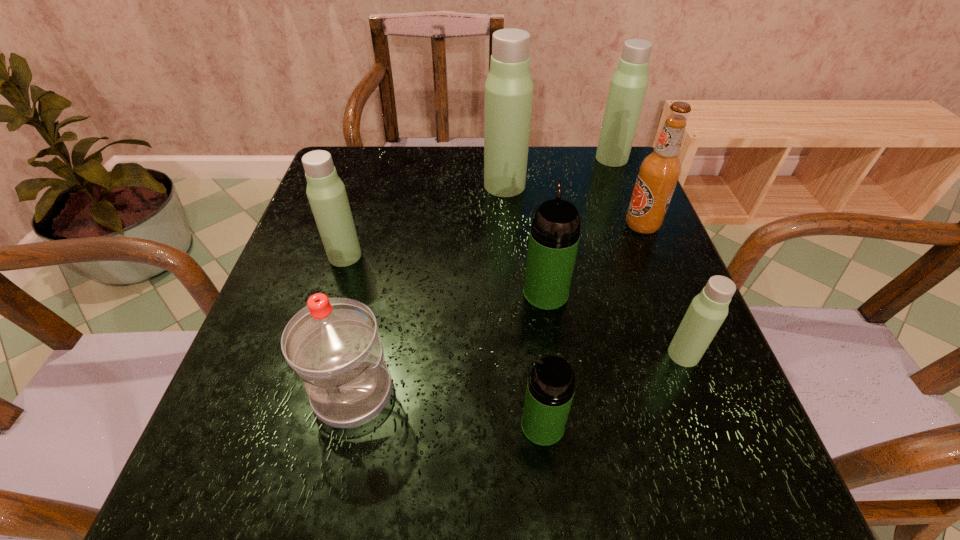
You are a GUI agent. You are given a task and a screenshot of the screen. Output one action in this format:
    pyautogui.click(x=<x>, y=<y>)
    Task: Click on the empty location between the fourth nearest object and the third farthest object
    The width and height of the screenshot is (960, 540).
    Given the screenshot: What is the action you would take?
    pyautogui.click(x=594, y=259)

This screenshot has width=960, height=540. Identify the location of free point between the second light thermos bottle from left to right and the second nearest thermos bottle. (594, 270).

Identify the location of free area in between the leftmost thermos bottle and the tallest thermos bottle. This screenshot has height=540, width=960. (424, 220).

Locate an element on the screen. The width and height of the screenshot is (960, 540). free space between the third farthest light thermos bottle and the tallest object is located at coordinates (424, 220).

You are a GUI agent. You are given a task and a screenshot of the screen. Output one action in this format:
    pyautogui.click(x=<x>, y=<y>)
    Task: Click on the empty space that is in between the smaller green thermos bottle and the smallest light thermos bottle
    This screenshot has width=960, height=540.
    Given the screenshot: What is the action you would take?
    pyautogui.click(x=613, y=390)

This screenshot has width=960, height=540. Identify the location of unoccupied area between the second farthest light thermos bottle and the farthest light thermos bottle. (558, 172).

Identify which object is located as the seventh nearest to the nearer green thermos bottle. Please provide its 2D coordinates. Your answer should be formatted as a tuple, i.e. [(x, y)], where the tuple contains the x and y coordinates of a point satisfying the conditions above.

[(628, 86)]

Image resolution: width=960 pixels, height=540 pixels. I want to click on object that is the closest to the smaller green thermos bottle, so [x=554, y=237].

Where is `thermos bottle that is the fifth closest to the second farthest light thermos bottle`? thermos bottle that is the fifth closest to the second farthest light thermos bottle is located at coordinates (550, 389).

Locate an element on the screen. thermos bottle that can be found as the closest to the bigger green thermos bottle is located at coordinates (708, 310).